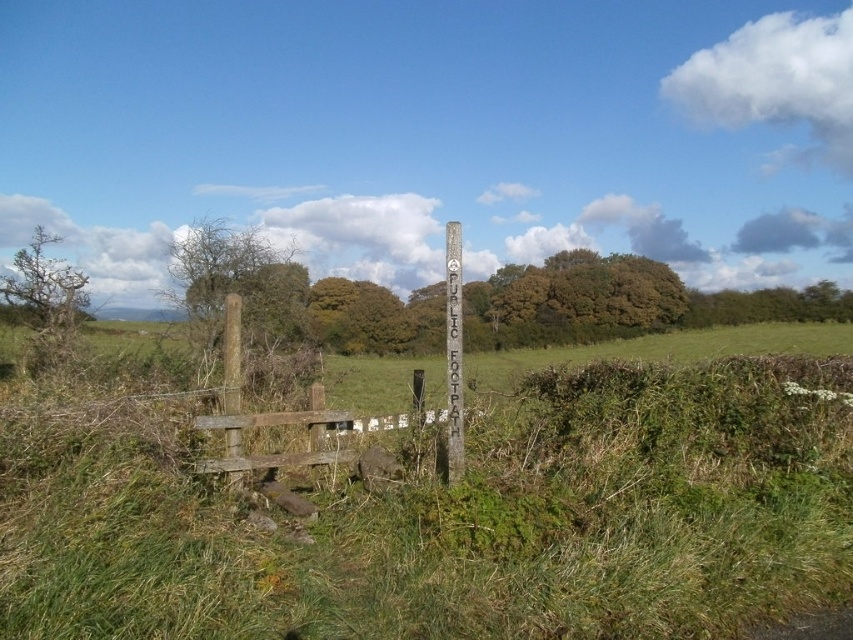
Can you confirm if wooden post at center is shorter than brown wooden post at left?

No.

In the scene shown: Who is taller, wooden post at center or brown wooden post at left?

Standing taller between the two is wooden post at center.

At what (x,y) coordinates should I click in order to perform the action: click on wooden post at center. Please return your answer as a coordinate pair (x, y). The height and width of the screenshot is (640, 853). Looking at the image, I should click on (454, 349).

Who is more distant from viewer, (767, 433) or (450, 272)?

The point (767, 433) is more distant.

Is point (845, 592) positioned before point (461, 369)?

Yes, point (845, 592) is in front of point (461, 369).

You are a GUI agent. You are given a task and a screenshot of the screen. Output one action in this format:
    pyautogui.click(x=<x>, y=<y>)
    Task: Click on the green grassy at center
    
    Given the screenshot: What is the action you would take?
    pyautogui.click(x=462, y=513)

Who is more forward, (212, 470) or (448, 257)?

Point (212, 470) is more forward.

Is brown wooden fence at lower left taller than wooden post at center?

No, brown wooden fence at lower left is not taller than wooden post at center.

Identify the location of brown wooden fence at lower left. Image resolution: width=853 pixels, height=640 pixels. (288, 424).

The width and height of the screenshot is (853, 640). Find the location of `brown wooden fence at lower left`. brown wooden fence at lower left is located at coordinates (288, 424).